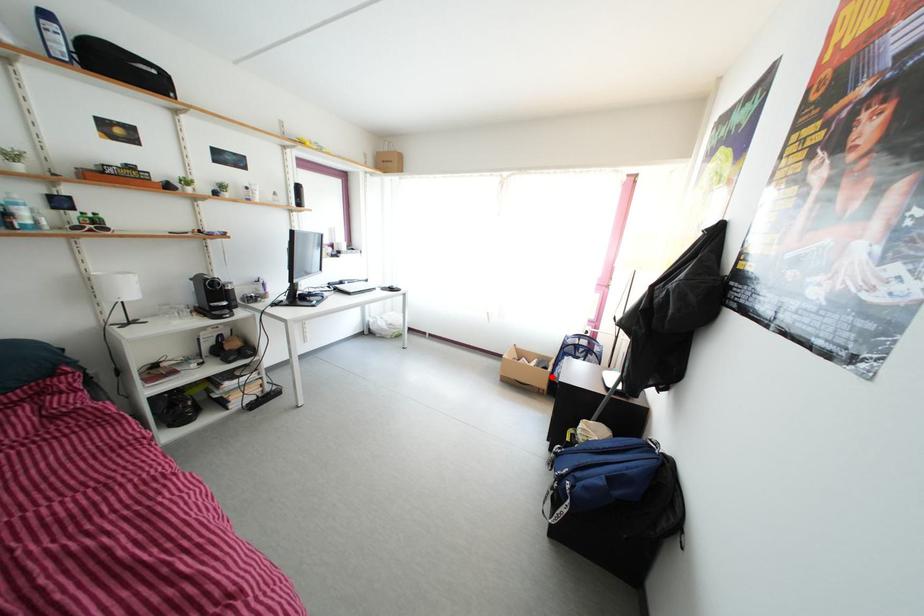
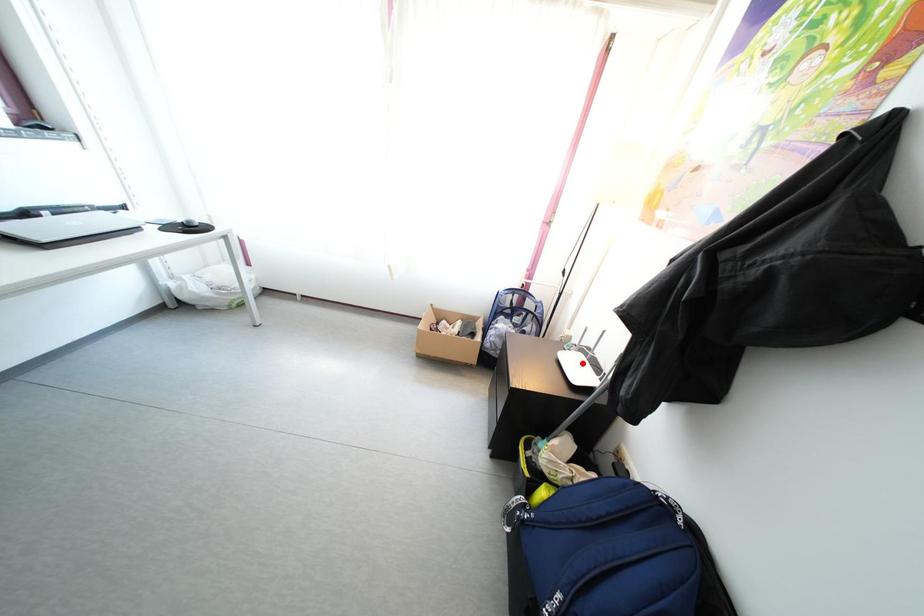
I am providing you with two images of the same scene from different viewpoints. A red point is marked on the first image and another point is marked on the second image. Do the highlighted points in image1 and image2 indicate the same real-world spot?

No